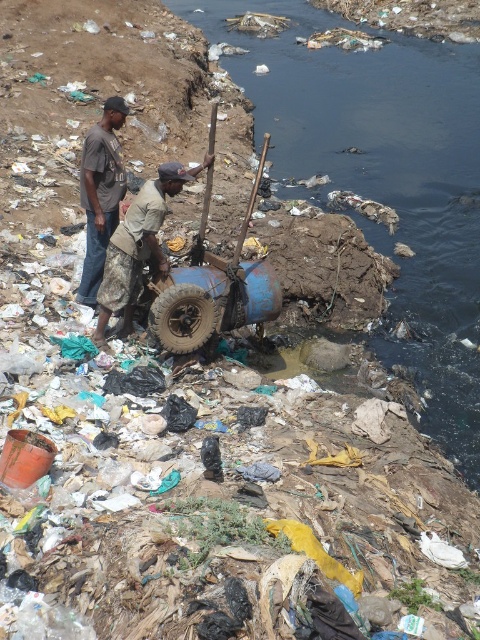
Question: Is the position of camouflage-patterned shirt at center less distant than that of dull brown rubber tire at center?

Choices:
 (A) yes
 (B) no

Answer: (B)

Question: Is black murky water at upper center below camouflage-patterned shirt at center?

Choices:
 (A) no
 (B) yes

Answer: (A)

Question: Among these objects, which one is farthest from the camera?

Choices:
 (A) dull brown rubber tire at center
 (B) camouflage-patterned shirt at center
 (C) brown cotton shirt at upper left
 (D) black murky water at upper center

Answer: (D)

Question: Which object appears farthest from the camera in this image?

Choices:
 (A) dull brown rubber tire at center
 (B) black murky water at upper center
 (C) brown cotton shirt at upper left
 (D) camouflage-patterned shirt at center

Answer: (B)

Question: Which point appears farthest from the camera in this image?

Choices:
 (A) (364, 220)
 (B) (132, 209)

Answer: (A)

Question: Is camouflage-patterned shirt at center further to the viewer compared to brown cotton shirt at upper left?

Choices:
 (A) yes
 (B) no

Answer: (B)